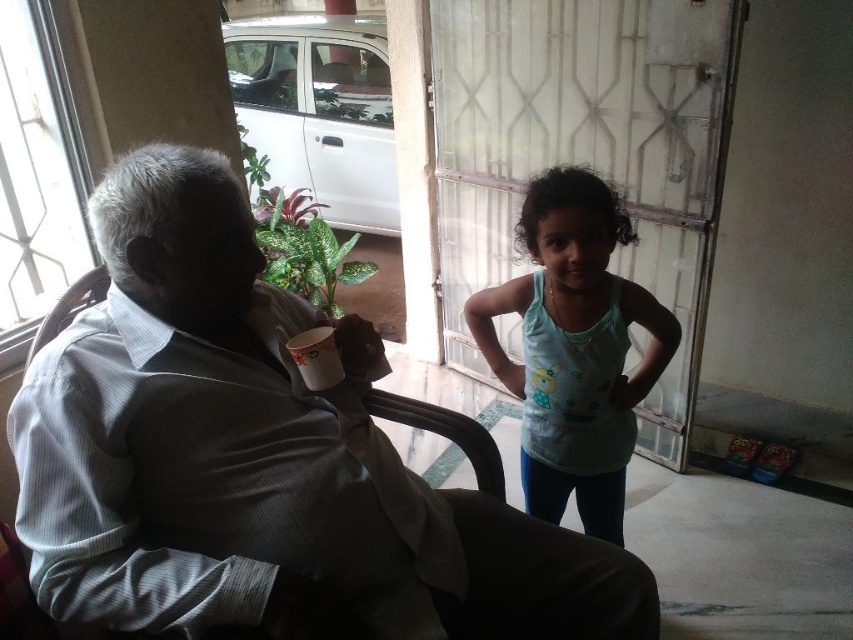
Which is behind, point (186, 164) or point (306, 330)?

Positioned behind is point (306, 330).

Where is `light brown fabric chair at center`? The width and height of the screenshot is (853, 640). light brown fabric chair at center is located at coordinates (259, 460).

The image size is (853, 640). Describe the element at coordinates (573, 348) in the screenshot. I see `light blue tank top at center` at that location.

Between point (607, 408) and point (323, 220), which one is positioned in front?

Point (607, 408) is more forward.

This screenshot has width=853, height=640. Find the location of `light blue tank top at center`. light blue tank top at center is located at coordinates (573, 348).

Does transparent plastic screen door at center have a lesser width compared to light blue tank top at center?

No.

Looking at this image, can you confirm if transparent plastic screen door at center is positioned below light blue tank top at center?

No.

Does point (697, 340) come closer to viewer compared to point (546, 349)?

No, it is not.

Where is `transparent plastic screen door at center`? transparent plastic screen door at center is located at coordinates (585, 152).